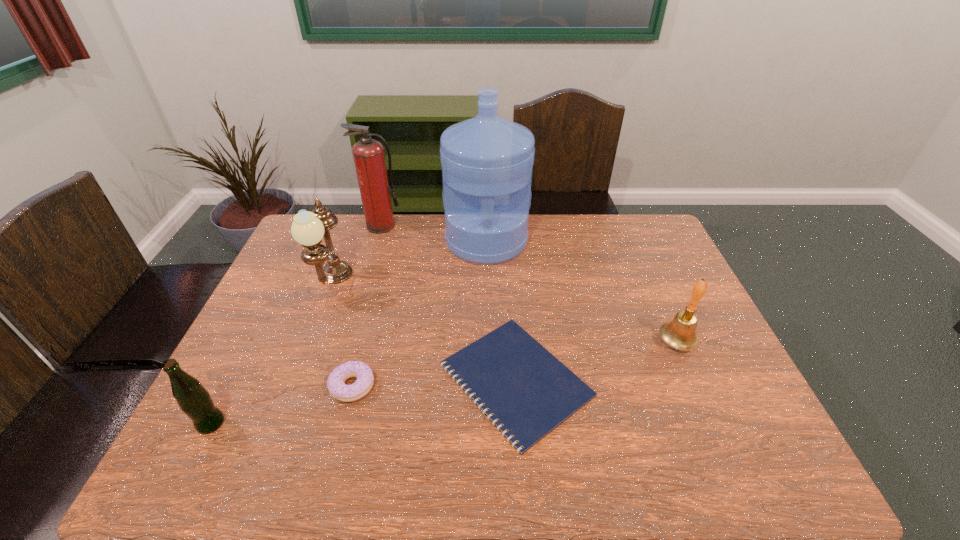
Image resolution: width=960 pixels, height=540 pixels. In order to click on vacant space that's between the second tallest object and the notepad in this screenshot , I will do `click(448, 303)`.

The width and height of the screenshot is (960, 540). I want to click on empty space between the oil lamp and the doughnut, so tap(343, 335).

This screenshot has height=540, width=960. In order to click on empty location between the notepad and the fire extinguisher in this screenshot , I will do `click(448, 303)`.

This screenshot has width=960, height=540. What are the coordinates of `free space between the rightmost object and the second tallest object` in the screenshot? It's located at (529, 284).

Identify the location of free space between the beer bottle and the tallest object. Image resolution: width=960 pixels, height=540 pixels. (348, 332).

Identify which object is the sixth nearest to the leftmost object. Please provide its 2D coordinates. Your answer should be formatted as a tuple, i.e. [(x, y)], where the tuple contains the x and y coordinates of a point satisfying the conditions above.

[(680, 333)]

The height and width of the screenshot is (540, 960). I want to click on object that is the fifth nearest to the second shortest object, so click(368, 154).

Locate an element on the screen. The height and width of the screenshot is (540, 960). free point that satisfies the following two spatial constraints: 1. on the side of the shortest object with the handle; 2. on the right side of the water jug is located at coordinates (489, 380).

Locate an element on the screen. vacant position in the image that satisfies the following two spatial constraints: 1. at the nozzle of the doughnut; 2. on the left side of the sixth shortest object is located at coordinates (334, 387).

The height and width of the screenshot is (540, 960). I want to click on vacant space that satisfies the following two spatial constraints: 1. at the nozzle of the bell; 2. on the right side of the second tallest object, so click(x=347, y=342).